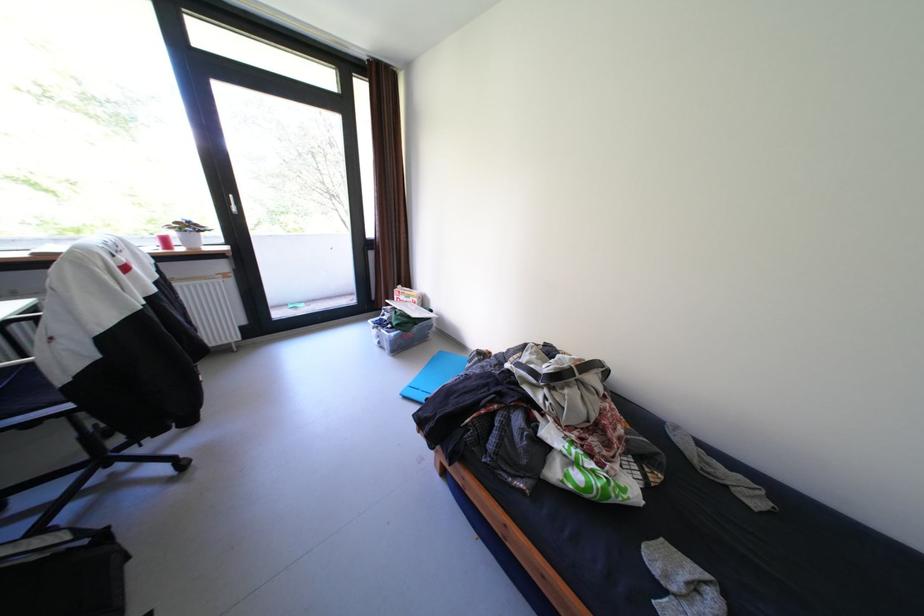
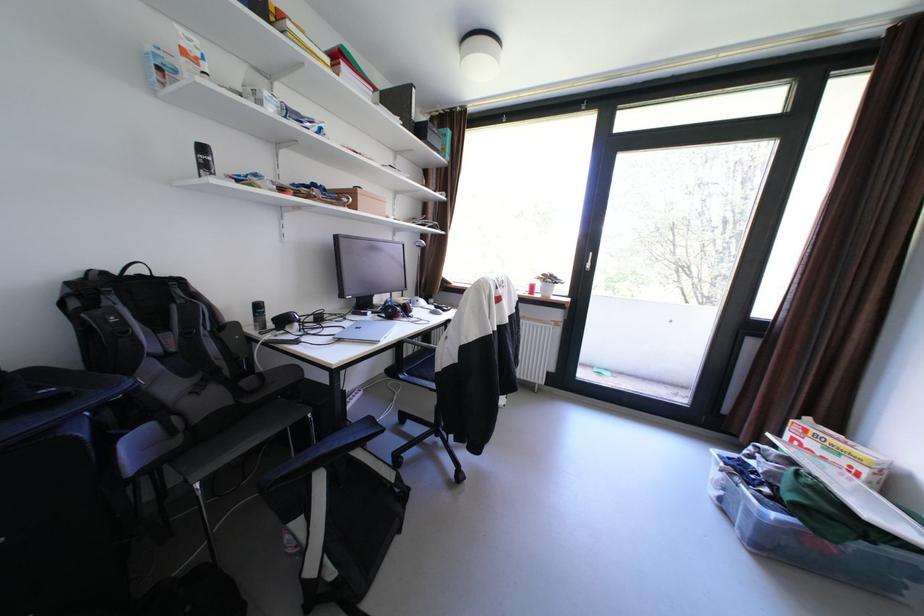
In the second image, find the point that corresponds to pixel 403 334 in the first image.

(784, 516)